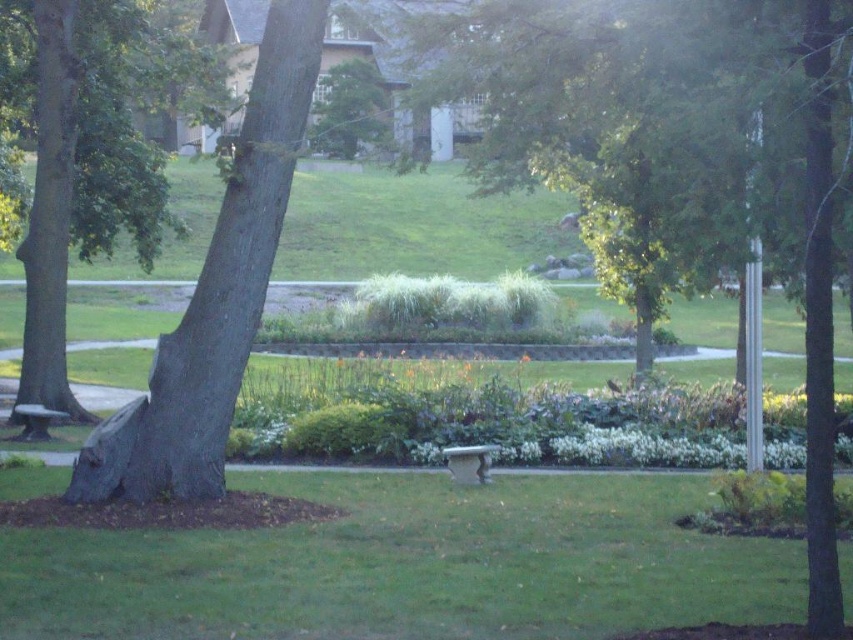
You are standing in the park and want to take a photo of the green rough bark tree at left. If your camera has a maximum zoom range of 10 meters, will you need to move closer to capture the tree in focus?

The green rough bark tree at left is 14.32 meters away from the viewer. Since the camera can only zoom up to 10 meters, you will need to move closer to ensure the tree is in focus.

You are standing in the park and see the green rough bark tree at left and the green leafy tree at upper center. Which tree is closer to you?

Answer: The green rough bark tree at left is closer to you because the green leafy tree at upper center is positioned behind it.

You are planning to plant a new tree in the park. The green rough bark tree at left and the green leafy tree at upper center are already present. Considering their widths, which tree would require more horizontal space to accommodate its spread?

The green rough bark tree at left requires more horizontal space because its width surpasses that of the green leafy tree at upper center.